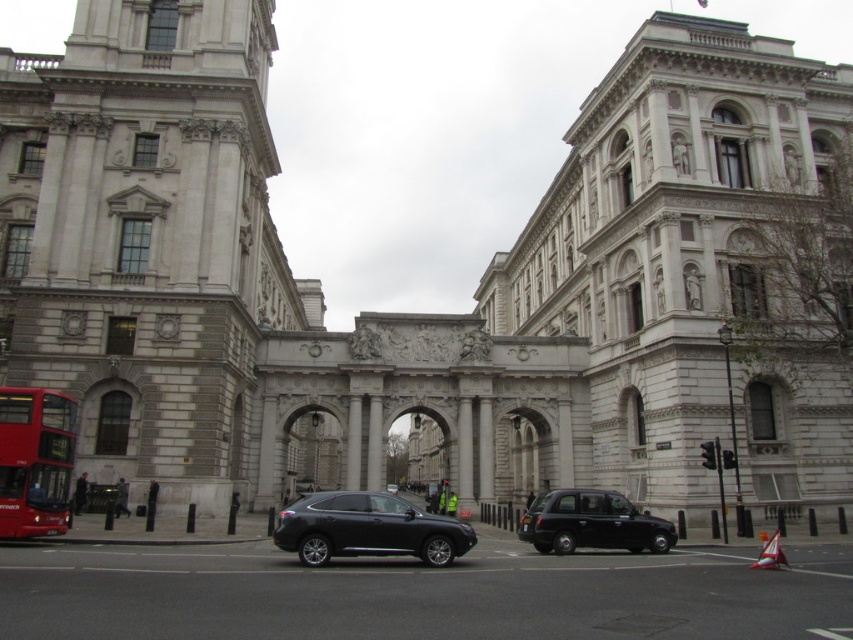
Question: From the image, what is the correct spatial relationship of black metallic taxi at center in relation to white plastic cone at lower right?

Choices:
 (A) right
 (B) left

Answer: (B)

Question: Observing the image, what is the correct spatial positioning of shiny black suv at center in reference to black metallic taxi at center?

Choices:
 (A) above
 (B) below

Answer: (B)

Question: Estimate the real-world distances between objects in this image. Which object is closer to the white plastic cone at lower right?

Choices:
 (A) red metallic bus at lower left
 (B) black metallic taxi at center
 (C) shiny black suv at center

Answer: (B)

Question: Is red metallic bus at lower left closer to the viewer compared to white plastic cone at lower right?

Choices:
 (A) yes
 (B) no

Answer: (B)

Question: Which object is farther from the camera taking this photo?

Choices:
 (A) shiny black suv at center
 (B) white plastic cone at lower right
 (C) black metallic taxi at center

Answer: (C)

Question: Which of the following is the closest to the observer?

Choices:
 (A) black metallic taxi at center
 (B) red metallic bus at lower left

Answer: (B)